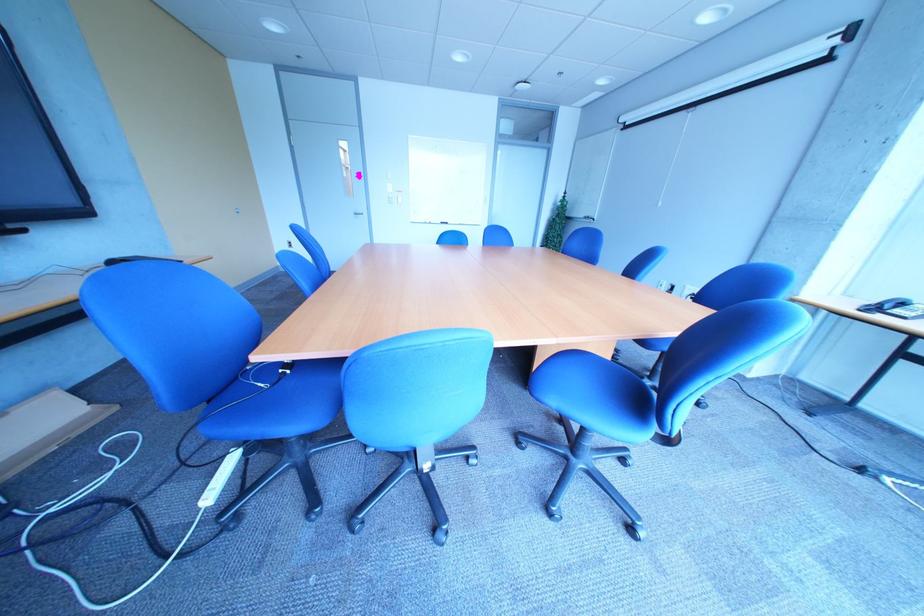
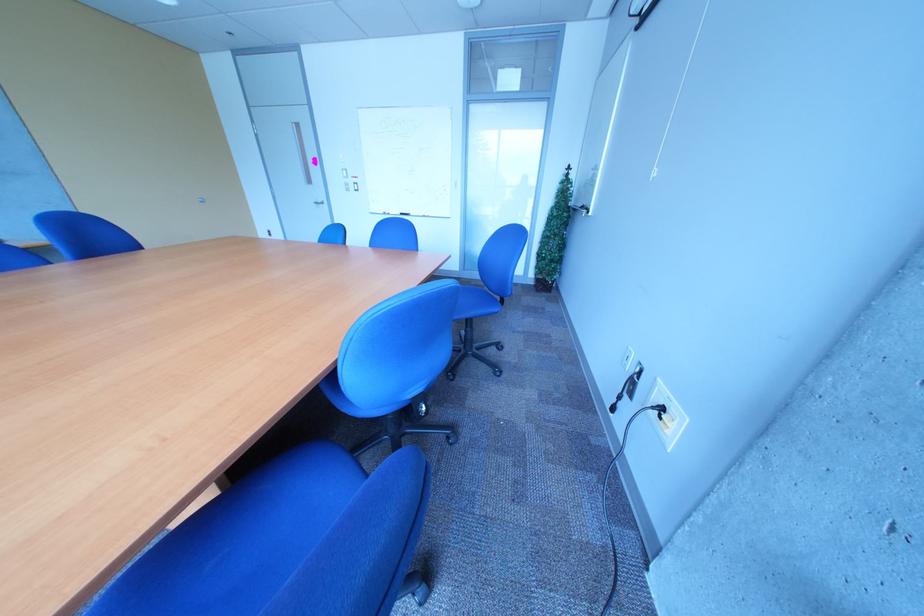
Find the pixel in the second image that matches the point at 445,225 in the first image.

(405, 216)